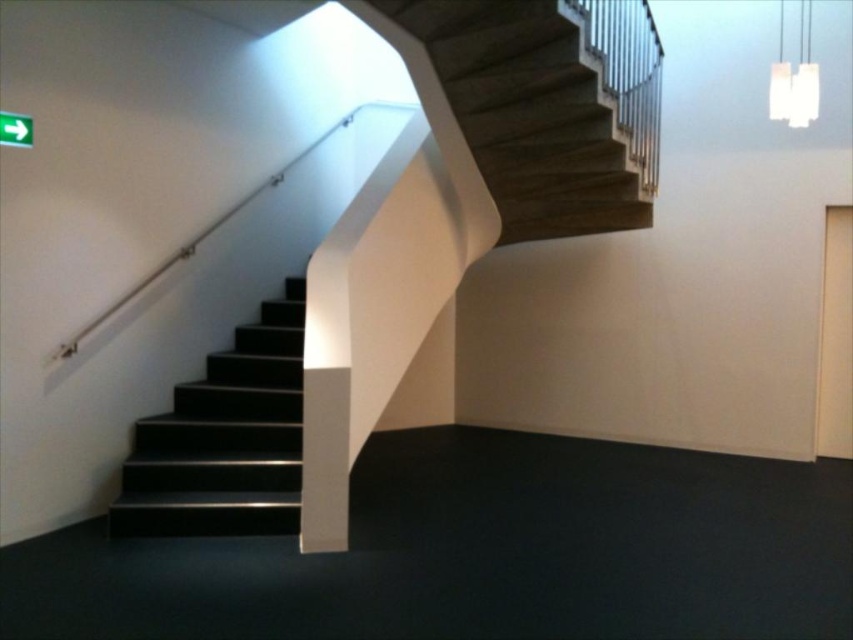
Is point (642, 196) closer to camera compared to point (277, 348)?

No.

Does point (643, 44) come behind point (138, 500)?

Yes, point (643, 44) is farther from viewer.

Is point (607, 177) positioned in front of point (263, 419)?

No, (607, 177) is behind (263, 419).

This screenshot has width=853, height=640. I want to click on dark wood stairs at upper center, so click(x=549, y=106).